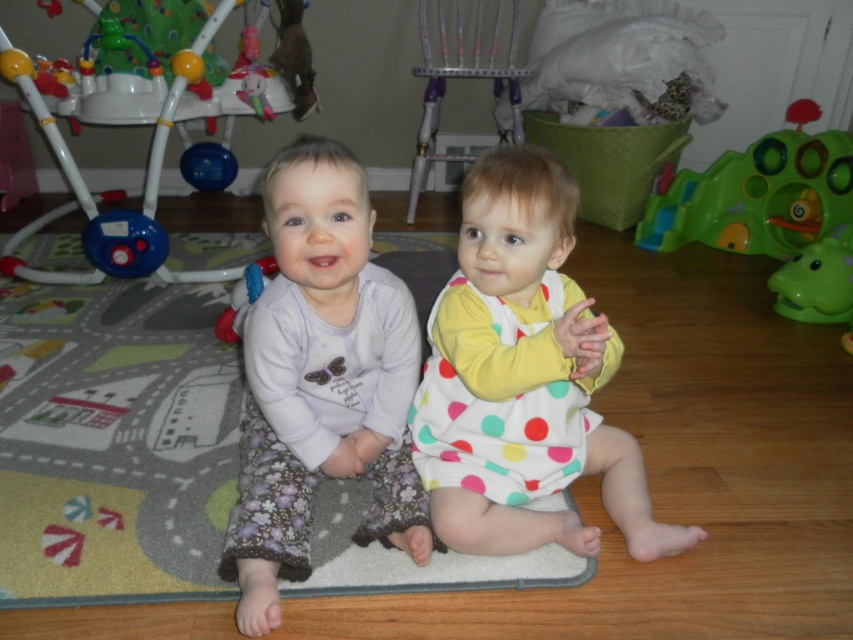
Between gray fabric mat at center and green plastic toy at right, which one appears on the right side from the viewer's perspective?

Positioned to the right is green plastic toy at right.

Who is more distant from viewer, (315, 588) or (697, 202)?

The point (697, 202) is behind.

Who is more distant from viewer, (20, 288) or (840, 148)?

The point (840, 148) is more distant.

Find the location of a particular element. gray fabric mat at center is located at coordinates (114, 442).

Which is behind, point (305, 436) or point (708, 228)?

The point (708, 228) is more distant.

Can you confirm if matte purple pajamas at center is wider than green plastic toy at right?

No, matte purple pajamas at center is not wider than green plastic toy at right.

Who is more distant from viewer, (334, 173) or (724, 192)?

The point (724, 192) is behind.

Locate an element on the screen. The width and height of the screenshot is (853, 640). matte purple pajamas at center is located at coordinates (321, 380).

Is gray fabric mat at center to the left of white polka dot dress at center from the viewer's perspective?

Correct, you'll find gray fabric mat at center to the left of white polka dot dress at center.

Is gray fabric mat at center positioned before white polka dot dress at center?

No, gray fabric mat at center is behind white polka dot dress at center.

What do you see at coordinates (114, 442) in the screenshot? I see `gray fabric mat at center` at bounding box center [114, 442].

Locate an element on the screen. Image resolution: width=853 pixels, height=640 pixels. gray fabric mat at center is located at coordinates (114, 442).